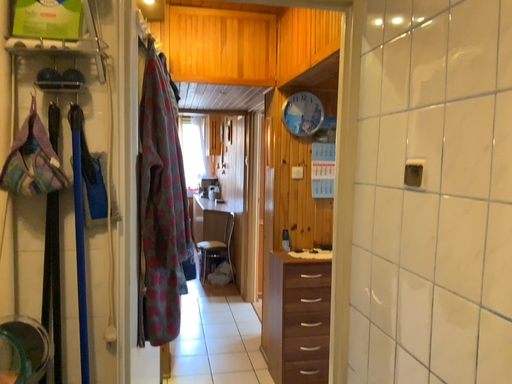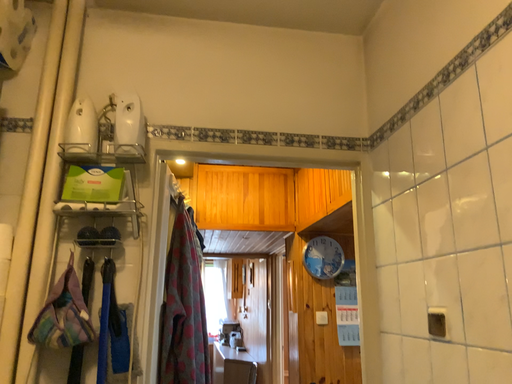
Question: Which way did the camera rotate in the video?

Choices:
 (A) rotated upward
 (B) rotated downward

Answer: (A)